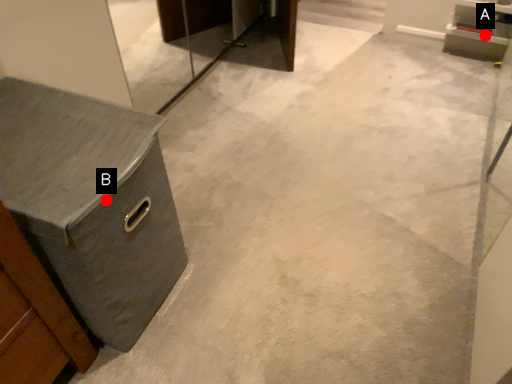
Question: Two points are circled on the image, labeled by A and B beside each circle. Which point appears farthest from the camera in this image?

Choices:
 (A) A is further
 (B) B is further

Answer: (A)